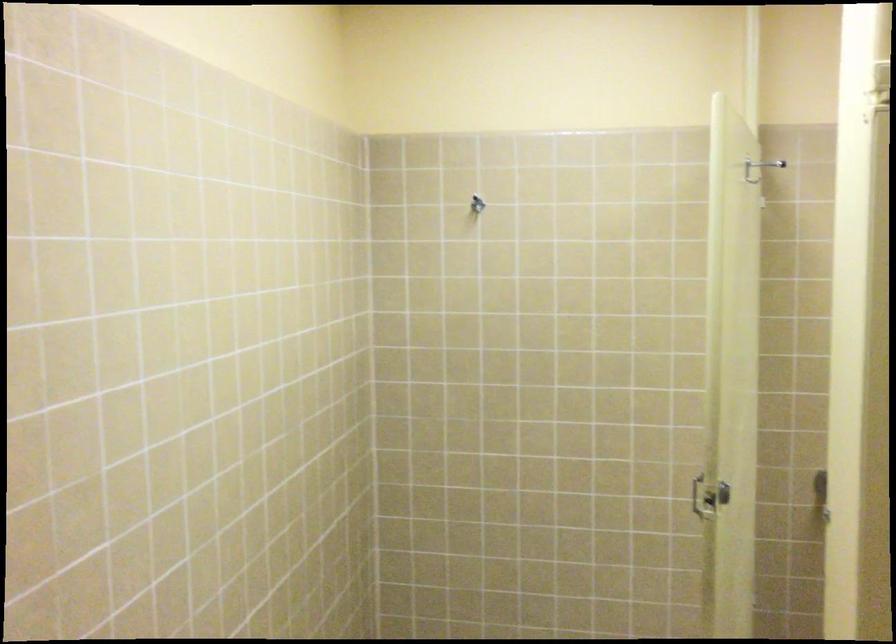
The width and height of the screenshot is (896, 644). Describe the element at coordinates (760, 167) in the screenshot. I see `a metal door hook` at that location.